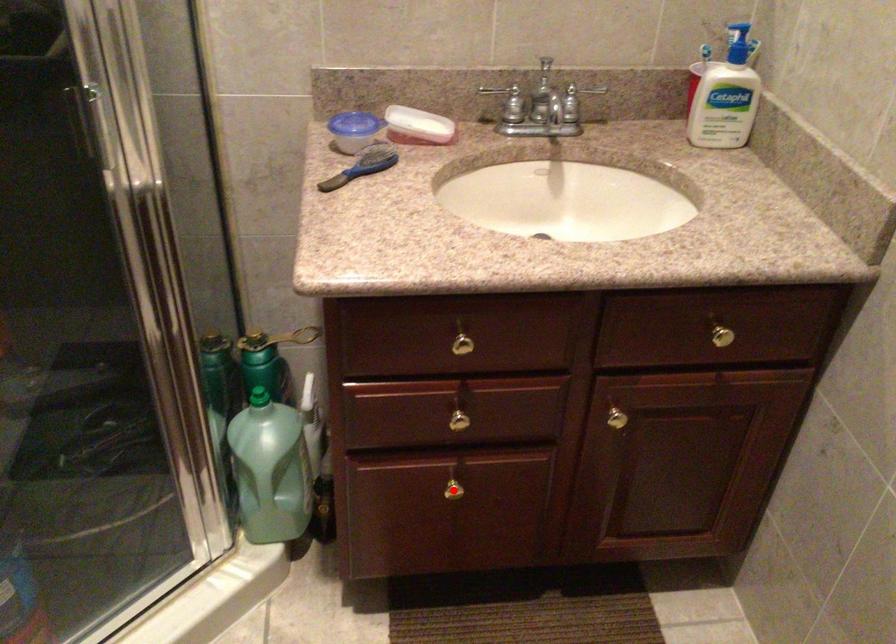
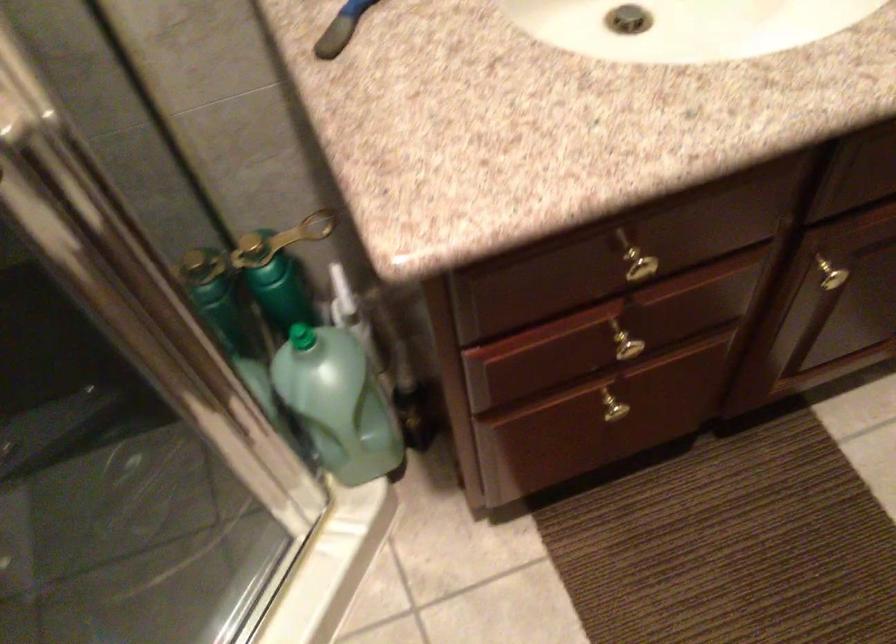
Question: A red point is marked in image1. In image2, is the corresponding 3D point closer to the camera or farther? Reply with the corresponding letter.

Choices:
 (A) The corresponding 3D point is closer.
 (B) The corresponding 3D point is farther.

Answer: (A)